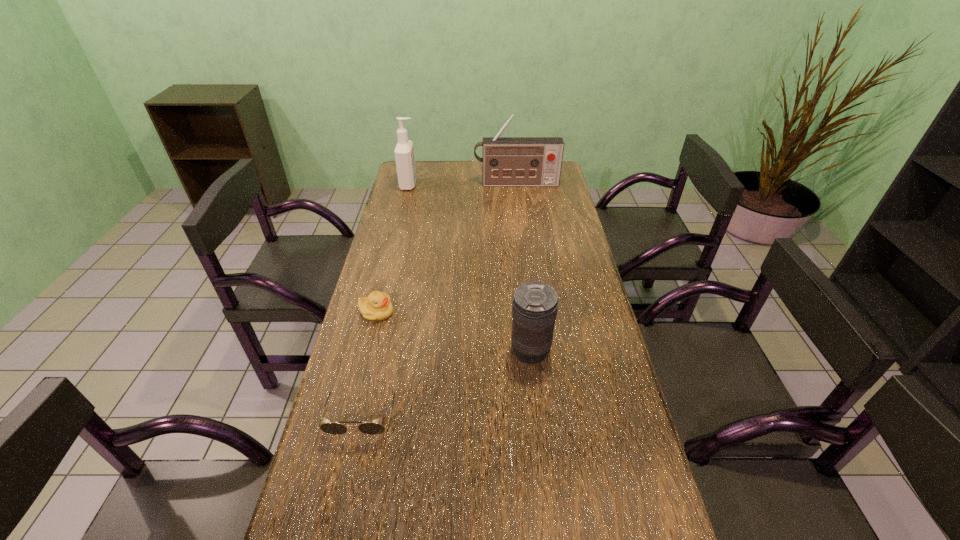
Identify the location of object located at the far right corner. (507, 161).

In the image, there is a desktop. At what (x,y) coordinates should I click in order to perform the action: click on vacant space at the far edge. Please return your answer as a coordinate pair (x, y). The width and height of the screenshot is (960, 540). Looking at the image, I should click on (443, 160).

Where is `vacant position at the left edge of the desktop`? This screenshot has height=540, width=960. vacant position at the left edge of the desktop is located at coordinates (369, 365).

The width and height of the screenshot is (960, 540). Find the location of `vacant space at the right edge`. vacant space at the right edge is located at coordinates tap(537, 195).

This screenshot has width=960, height=540. What are the coordinates of `unoccupied area between the cleansing agent and the duckling` in the screenshot? It's located at (393, 248).

Find the location of a particular element. Image resolution: width=960 pixels, height=540 pixels. free space between the cleansing agent and the telephoto lens is located at coordinates pos(469,268).

The height and width of the screenshot is (540, 960). I want to click on free space between the radio receiver and the third nearest object, so click(446, 248).

Identify the location of free spot between the radio receiver and the cleansing agent. The image size is (960, 540). (463, 184).

Where is `vacant area that lies between the third tallest object and the cleansing agent`? This screenshot has width=960, height=540. vacant area that lies between the third tallest object and the cleansing agent is located at coordinates (469, 268).

Image resolution: width=960 pixels, height=540 pixels. I want to click on vacant space that's between the nearest object and the third nearest object, so click(x=370, y=363).